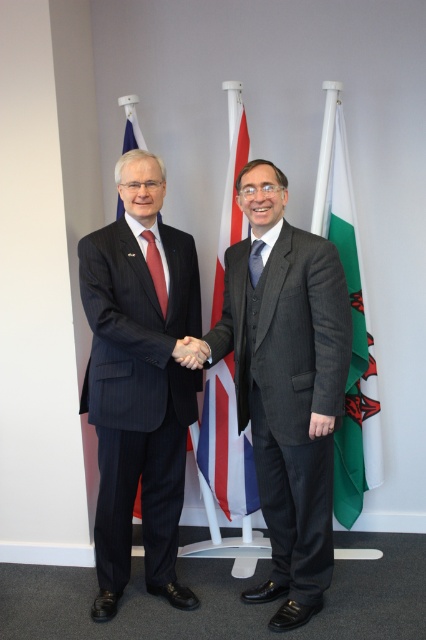
Who is more forward, (273, 547) or (152, 241)?

Point (152, 241) is in front.

From the picture: Between dark gray suit at center and matte red tie at center, which one appears on the left side from the viewer's perspective?

matte red tie at center is more to the left.

This screenshot has width=426, height=640. Identify the location of dark gray suit at center. (287, 385).

This screenshot has width=426, height=640. Find the location of `dark gray suit at center`. dark gray suit at center is located at coordinates (287, 385).

Measure the distance between point (115, 509) and camera.

Point (115, 509) is 7.97 feet from camera.

Does dark blue pinstripe suit at center have a lesser height compared to red and white striped flag at center?

Yes, dark blue pinstripe suit at center is shorter than red and white striped flag at center.

Is point (118, 486) closer to viewer compared to point (221, 406)?

Yes, it is in front of point (221, 406).

Identify the location of dark blue pinstripe suit at center. The image size is (426, 640). (138, 384).

Which is above, red and white striped flag at center or dark blue silk tie at center?

dark blue silk tie at center is higher up.

Consider the image. Who is shorter, red and white striped flag at center or dark blue silk tie at center?

dark blue silk tie at center is shorter.

Describe the element at coordinates (226, 445) in the screenshot. I see `red and white striped flag at center` at that location.

Identify the location of red and white striped flag at center. (226, 445).